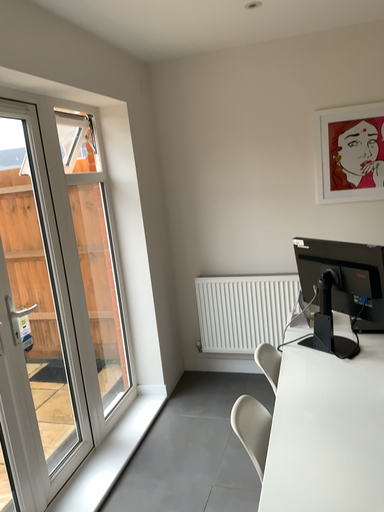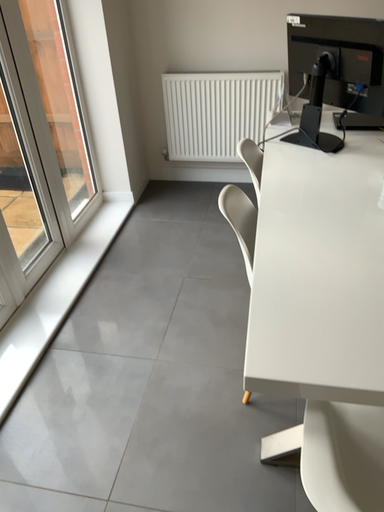
Question: Which way did the camera rotate in the video?

Choices:
 (A) rotated upward
 (B) rotated downward

Answer: (B)